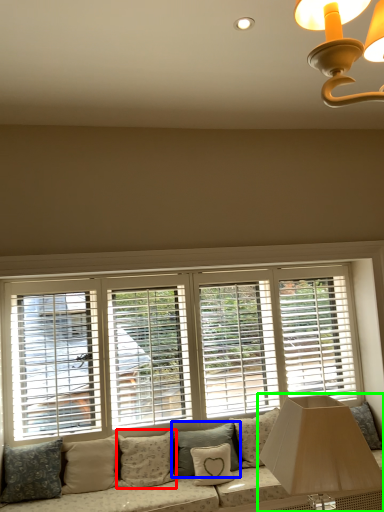
Question: Based on their relative distances, which object is nearer to pillow (highlighted by a red box)? Choose from pillow (highlighted by a blue box) and table lamp (highlighted by a green box).

Choices:
 (A) pillow
 (B) table lamp

Answer: (A)